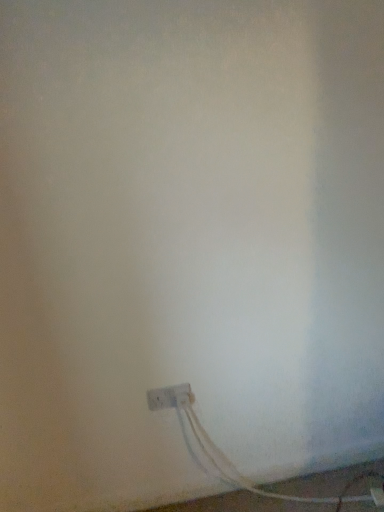
Locate an element on the screen. The height and width of the screenshot is (512, 384). white plastic power plug at lower right is located at coordinates (169, 397).

The image size is (384, 512). Describe the element at coordinates (169, 397) in the screenshot. I see `white plastic power plug at lower right` at that location.

Where is `white plastic power plug at lower right`? This screenshot has height=512, width=384. white plastic power plug at lower right is located at coordinates (169, 397).